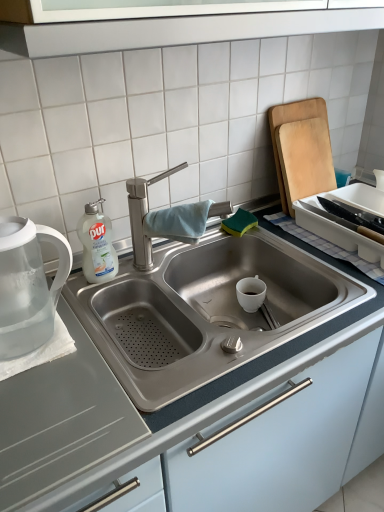
Question: Does transparent plastic tea pot at left touch satin steel sink at center?

Choices:
 (A) yes
 (B) no

Answer: (B)

Question: Is transparent plastic tea pot at left oriented away from satin steel sink at center?

Choices:
 (A) yes
 (B) no

Answer: (B)

Question: Is transparent plastic tea pot at left not near satin steel sink at center?

Choices:
 (A) yes
 (B) no

Answer: (B)

Question: From a real-world perspective, is transparent plastic tea pot at left physically below satin steel sink at center?

Choices:
 (A) no
 (B) yes

Answer: (A)

Question: Considering the relative sizes of transparent plastic tea pot at left and satin steel sink at center in the image provided, is transparent plastic tea pot at left shorter than satin steel sink at center?

Choices:
 (A) yes
 (B) no

Answer: (A)

Question: Can you confirm if transparent plastic tea pot at left is smaller than satin steel sink at center?

Choices:
 (A) no
 (B) yes

Answer: (B)

Question: Does white plastic tray at upper right turn towards satin steel sink at center?

Choices:
 (A) no
 (B) yes

Answer: (A)

Question: Is the position of white plastic tray at upper right more distant than that of satin steel sink at center?

Choices:
 (A) yes
 (B) no

Answer: (A)

Question: Is white plastic tray at upper right completely or partially outside of satin steel sink at center?

Choices:
 (A) yes
 (B) no

Answer: (B)

Question: Considering the relative positions of white plastic tray at upper right and satin steel sink at center in the image provided, is white plastic tray at upper right to the right of satin steel sink at center from the viewer's perspective?

Choices:
 (A) no
 (B) yes

Answer: (B)

Question: From a real-world perspective, is white plastic tray at upper right positioned over satin steel sink at center based on gravity?

Choices:
 (A) no
 (B) yes

Answer: (B)

Question: Is white plastic tray at upper right thinner than satin steel sink at center?

Choices:
 (A) yes
 (B) no

Answer: (A)

Question: Are white plastic tray at upper right and transparent plastic tea pot at left making contact?

Choices:
 (A) yes
 (B) no

Answer: (B)